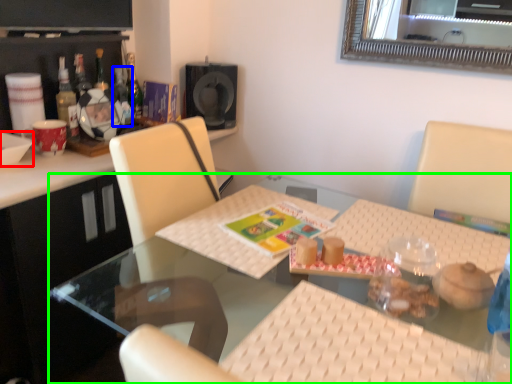
Question: Which object is the closest to the bowl (highlighted by a red box)? Choose among these: bottle (highlighted by a blue box) or table (highlighted by a green box).

Choices:
 (A) bottle
 (B) table

Answer: (A)